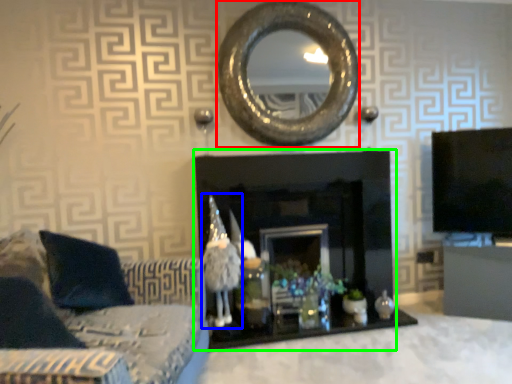
Question: Which object is positioned closest to oval (highlighted by a red box)? Select from toy (highlighted by a blue box) and fireplace (highlighted by a green box).

Choices:
 (A) toy
 (B) fireplace

Answer: (B)